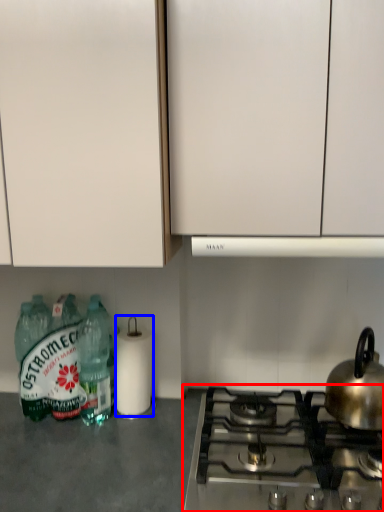
Question: Among these objects, which one is nearest to the camera, gas stove (highlighted by a red box) or paper towel (highlighted by a blue box)?

Choices:
 (A) gas stove
 (B) paper towel

Answer: (A)